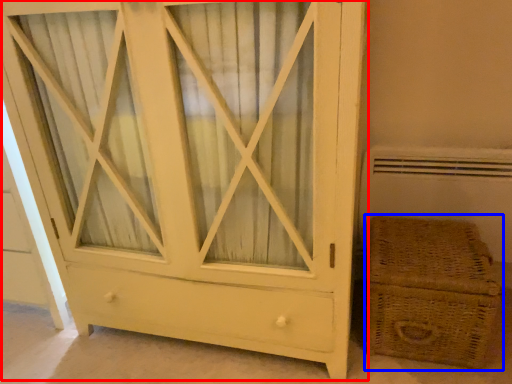
Question: Which object is closer to the camera taking this photo, chest of drawers (highlighted by a red box) or basket (highlighted by a blue box)?

Choices:
 (A) chest of drawers
 (B) basket

Answer: (A)